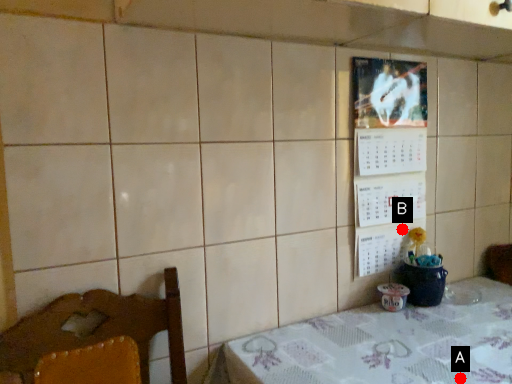
Question: Two points are circled on the image, labeled by A and B beside each circle. Among these points, which one is farthest from the camera?

Choices:
 (A) A is further
 (B) B is further

Answer: (B)